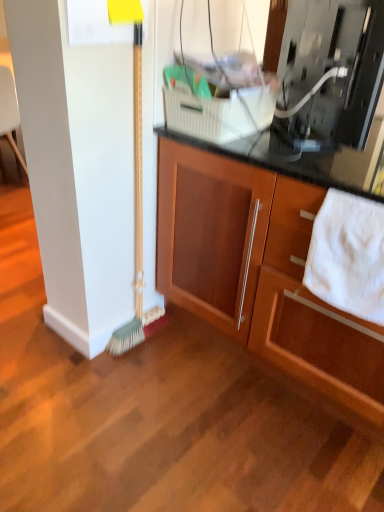
This screenshot has height=512, width=384. Identify the location of vacant space to the right of green bristle broom at left. pyautogui.click(x=178, y=343).